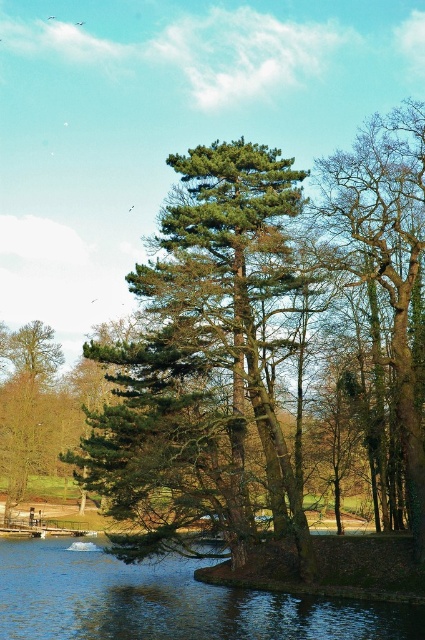
You are planning to plant a new tree in your backyard. You want to ensure that the green textured tree at center will not overshadow the brown textured tree at right once they both mature. Based on the scene, which tree should you place closer to the south side to ensure proper sunlight for both?

The green textured tree at center is taller than the brown textured tree at right. To ensure proper sunlight for both, you should place the shorter brown textured tree at right closer to the south side so it can receive more sunlight, while the taller green textured tree at center can provide some shade without completely overshadowing it.